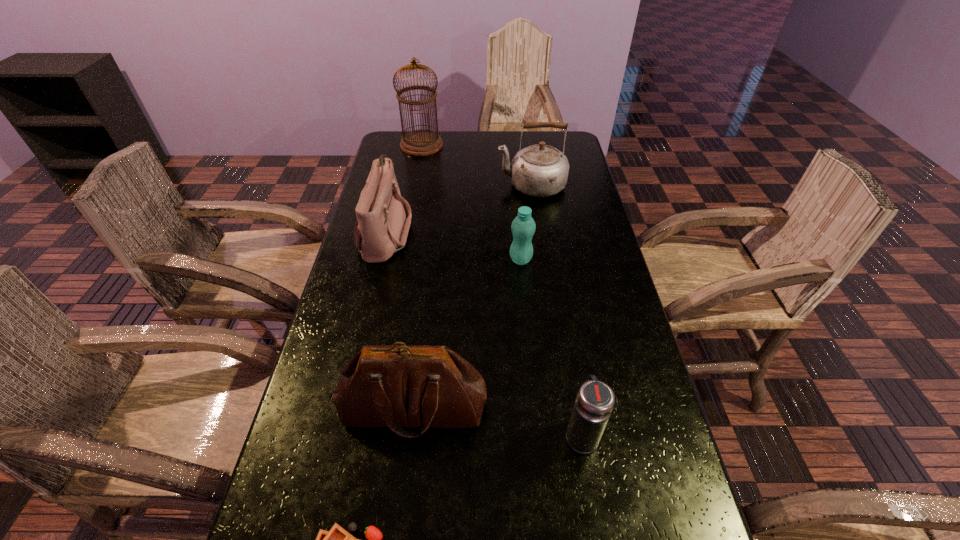
Where is `blank area located 0.290m at the spout of the kettle`? The height and width of the screenshot is (540, 960). blank area located 0.290m at the spout of the kettle is located at coordinates (416, 185).

You are a GUI agent. You are given a task and a screenshot of the screen. Output one action in this format:
    pyautogui.click(x=<x>, y=<y>)
    Task: Click on the vacant region located on the back of the nearer shoulder bag
    
    Given the screenshot: What is the action you would take?
    pyautogui.click(x=429, y=271)

Identify the location of blank area located on the front pocket of the farther shoulder bag. (491, 232).

Where is `vacant point located 0.300m on the left of the bottle`? This screenshot has height=540, width=960. vacant point located 0.300m on the left of the bottle is located at coordinates (407, 260).

The height and width of the screenshot is (540, 960). Find the location of `free space located with a handle on the side of the thermos bottle`. free space located with a handle on the side of the thermos bottle is located at coordinates (569, 361).

This screenshot has height=540, width=960. Identify the location of blank area located with a handle on the side of the thermos bottle. (566, 347).

Where is `vacant region located 0.310m with a handle on the side of the thermos bottle`? The width and height of the screenshot is (960, 540). vacant region located 0.310m with a handle on the side of the thermos bottle is located at coordinates (560, 307).

This screenshot has width=960, height=540. In order to click on object situated at the far edge in this screenshot , I will do `click(422, 142)`.

The image size is (960, 540). Find the location of `birdcage positioned at the left edge`. birdcage positioned at the left edge is located at coordinates (422, 142).

Where is `kettle located at the right edge`? This screenshot has width=960, height=540. kettle located at the right edge is located at coordinates (541, 170).